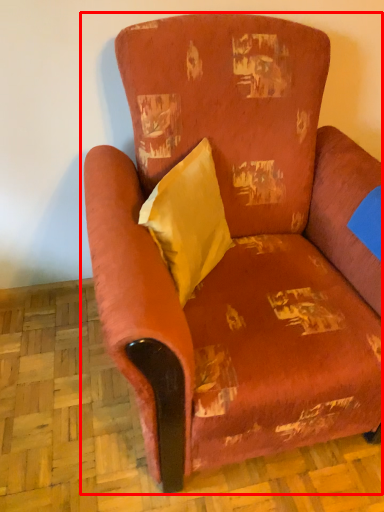
Question: Where is chair (annotated by the red box) located in relation to throw pillow in the image?

Choices:
 (A) left
 (B) right

Answer: (B)